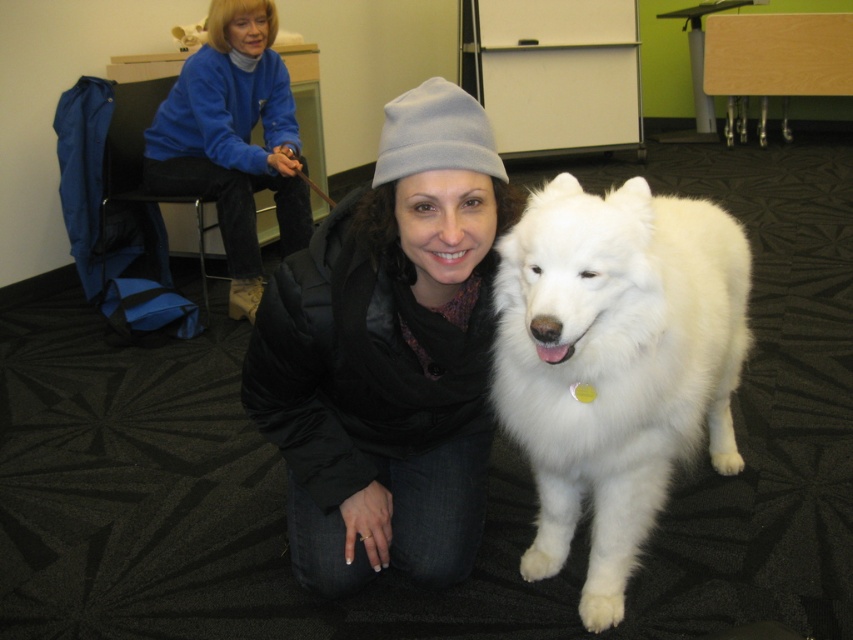
Which of these two, black puffy jacket at center or blue fleece jacket at upper left, stands shorter?

black puffy jacket at center

Does black puffy jacket at center have a larger size compared to blue fleece jacket at upper left?

Incorrect, black puffy jacket at center is not larger than blue fleece jacket at upper left.

Between point (286, 419) and point (247, 275), which one is positioned in front?

Point (286, 419)

Find the location of a particular element. black puffy jacket at center is located at coordinates (387, 355).

Which is in front, point (621, 364) or point (229, 264)?

Point (621, 364) is more forward.

Which is in front, point (537, 429) or point (222, 65)?

Point (537, 429)

Identify the location of white fluffy dog at center. tap(614, 364).

Is black puffy jacket at center smaller than white fluffy dog at center?

Yes, black puffy jacket at center is smaller than white fluffy dog at center.

Who is more forward, (274, 403) or (695, 312)?

Point (695, 312) is in front.

This screenshot has width=853, height=640. In order to click on black puffy jacket at center in this screenshot , I will do `click(387, 355)`.